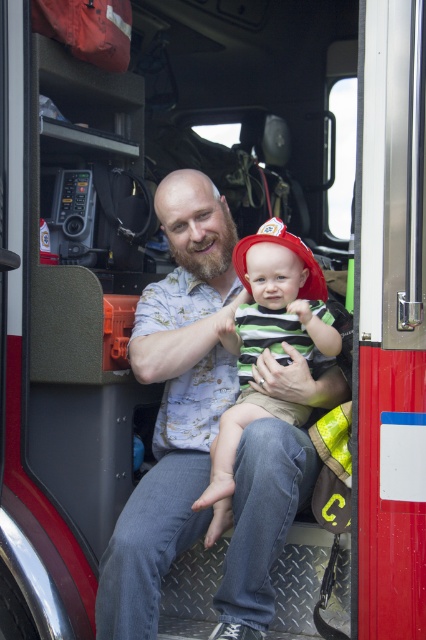
You are a firefighter standing on the ground outside the fire truck. You need to hand a safety manual to the person wearing the matte blue shirt at center. The manual is 1.8 meters long. Can you reach them without climbing onto the fire truck?

The distance between you and the matte blue shirt at center is 1.93 meters. Since the manual is 1.8 meters long, you cannot reach them without climbing onto the fire truck.

You are a photographer taking a picture of two people sitting on a fire truck step. You notice the matte blue shirt at center and the striped cotton shirt at center. Which shirt is positioned more to the left?

The matte blue shirt at center is positioned to the left of the striped cotton shirt at center, so the matte blue shirt at center is more to the left.